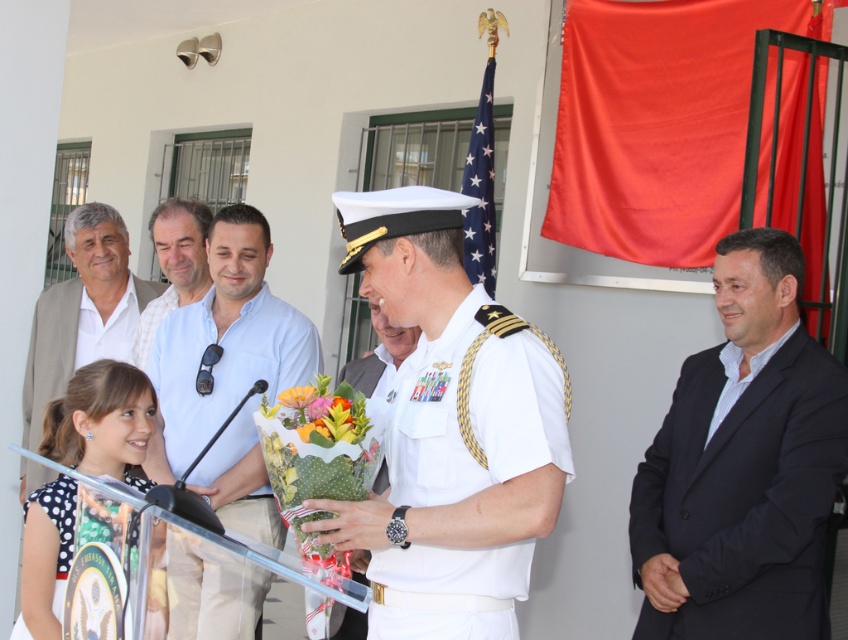
Question: Is navy blue suit at right bigger than matte white shirt at center?

Choices:
 (A) no
 (B) yes

Answer: (B)

Question: Which object is closer to the camera taking this photo?

Choices:
 (A) white dotted dress at lower left
 (B) navy blue suit at right

Answer: (A)

Question: Does light beige suit at left have a smaller size compared to yellow matte flower at center?

Choices:
 (A) yes
 (B) no

Answer: (B)

Question: Is white dotted dress at lower left positioned behind light beige suit at left?

Choices:
 (A) no
 (B) yes

Answer: (A)

Question: Based on their relative distances, which object is nearer to the navy blue suit at right?

Choices:
 (A) yellow matte flower at center
 (B) matte white shirt at center

Answer: (A)

Question: Considering the real-world distances, which object is farthest from the light beige suit at left?

Choices:
 (A) white dotted dress at lower left
 (B) glossy floral bouquet at center
 (C) white cotton shirt at center
 (D) white matte uniform at center

Answer: (D)